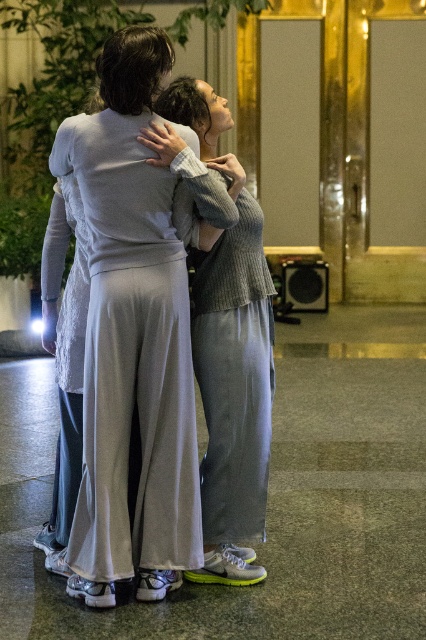
From the picture: You are standing in the lobby and want to place a small decorative item exactly halfway between point (138,99) and point (212,209). Which direction should you move from the midpoint to ensure the item is closer to the camera?

To place the item closer to the camera, move it towards point (138,99) from the midpoint since it is closer to the camera than point (212,209).

You are a fashion designer observing two people in an indoor lobby. You notice the light gray knit sweater at center and the knitted gray sweater at center. Which one has a larger size?

The light gray knit sweater at center is bigger than the knitted gray sweater at center, so the light gray knit sweater at center has a larger size.